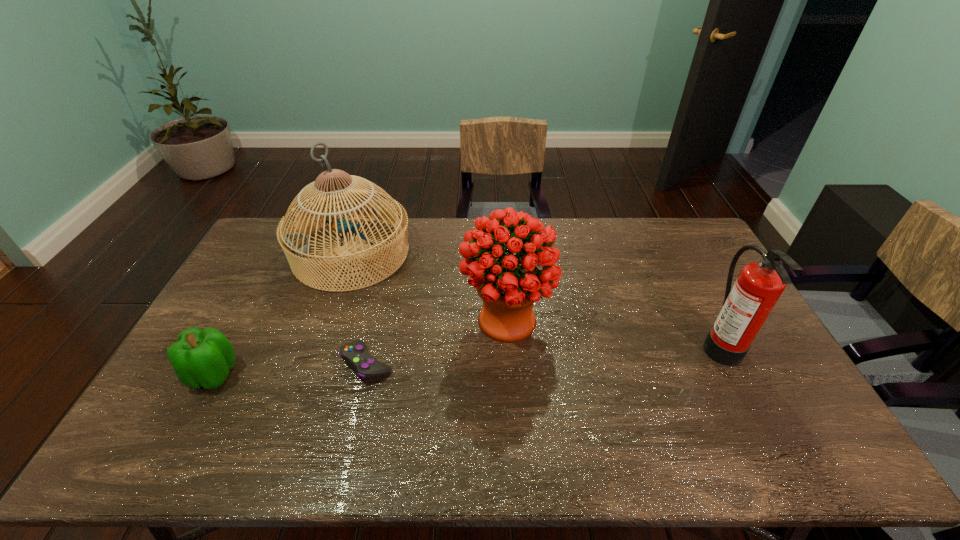
This screenshot has width=960, height=540. Identify the location of vacant space situated on the back of the bell pepper. (252, 303).

The height and width of the screenshot is (540, 960). Find the location of `free space located 0.190m on the back of the shortest object`. free space located 0.190m on the back of the shortest object is located at coordinates (382, 298).

Locate an element on the screen. object positioned at the far edge is located at coordinates (296, 246).

Identify the location of birdcage located at the left edge. The width and height of the screenshot is (960, 540). (296, 246).

Locate an element on the screen. The height and width of the screenshot is (540, 960). bell pepper at the left edge is located at coordinates (200, 358).

Find the location of a particular element. This screenshot has height=540, width=960. object located at the right edge is located at coordinates (746, 307).

Locate an element on the screen. Image resolution: width=960 pixels, height=540 pixels. object that is at the far left corner is located at coordinates (296, 246).

Where is `free space at the far edge of the desktop`? The width and height of the screenshot is (960, 540). free space at the far edge of the desktop is located at coordinates (621, 241).

Where is `free location at the near edge of the desktop`? free location at the near edge of the desktop is located at coordinates (638, 439).

Find the location of a particular element. The width and height of the screenshot is (960, 540). free spot at the left edge of the desktop is located at coordinates (159, 395).